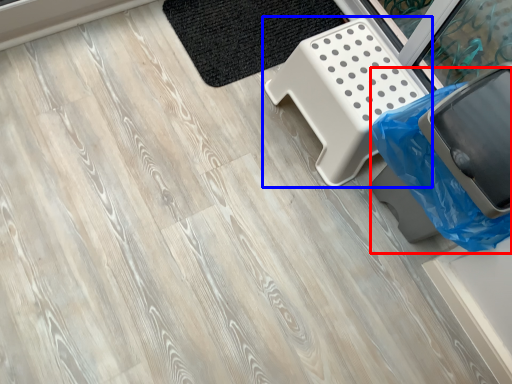
Question: Which of the following is the closest to the observer, garbage (highlighted by a red box) or furniture (highlighted by a blue box)?

Choices:
 (A) garbage
 (B) furniture

Answer: (A)